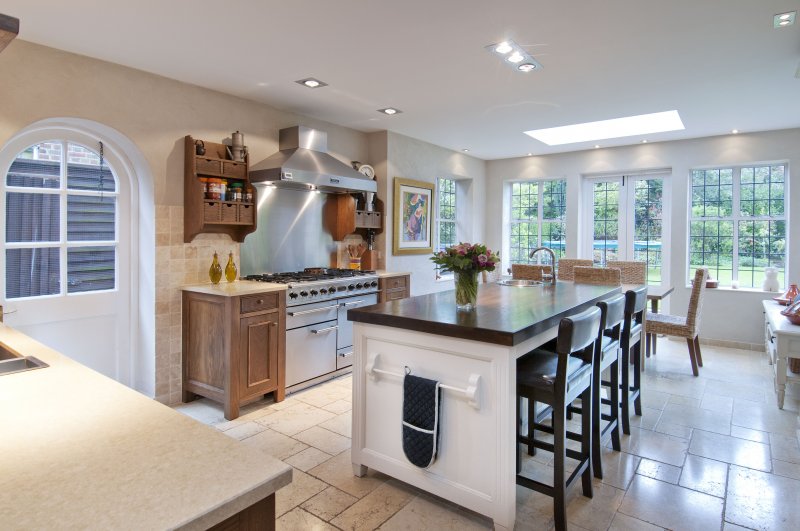
This screenshot has height=531, width=800. I want to click on accent lights, so click(x=738, y=130).